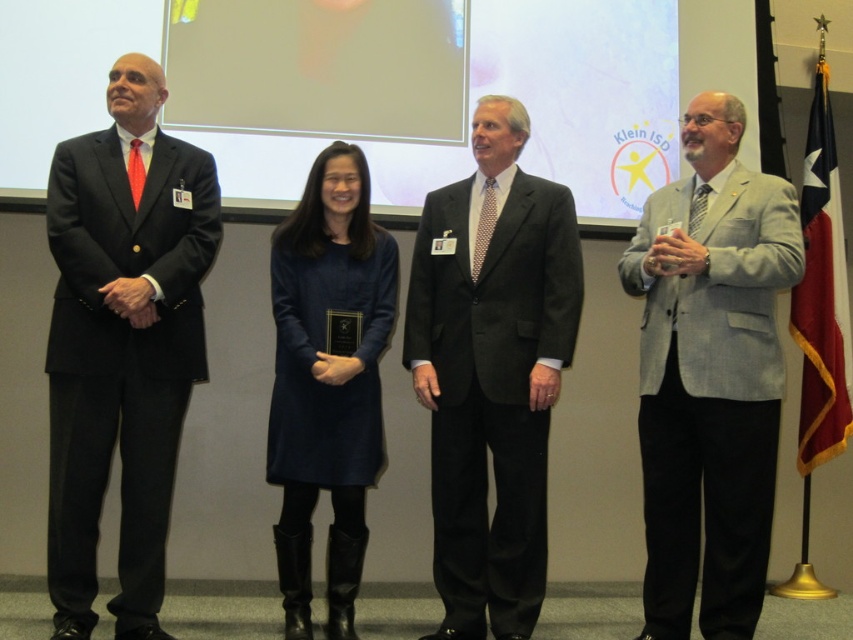
Question: Does black suit at left have a greater width compared to gray textured blazer at right?

Choices:
 (A) no
 (B) yes

Answer: (B)

Question: Is black suit at left further to camera compared to dark blue fabric dress at center?

Choices:
 (A) no
 (B) yes

Answer: (A)

Question: Among these points, which one is nearest to the camera?

Choices:
 (A) (722, 269)
 (B) (337, 561)
 (C) (495, 324)
 (D) (173, 454)

Answer: (A)

Question: Among these points, which one is nearest to the camera?

Choices:
 (A) (527, 486)
 (B) (354, 269)
 (C) (175, 436)

Answer: (C)

Question: Is black suit at left bigger than gray textured blazer at right?

Choices:
 (A) no
 (B) yes

Answer: (A)

Question: Among these objects, which one is nearest to the camera?

Choices:
 (A) dark gray suit at center
 (B) gray textured blazer at right

Answer: (B)